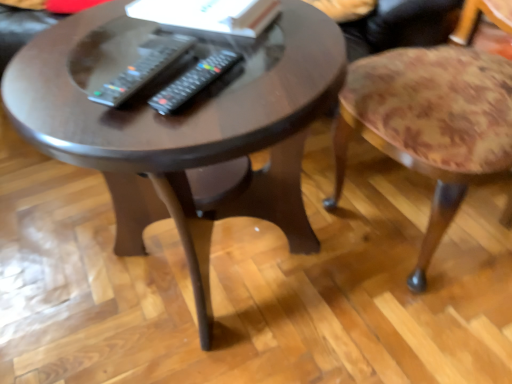
I want to click on free region under dark wood coffee table at center (from a real-world perspective), so click(208, 275).